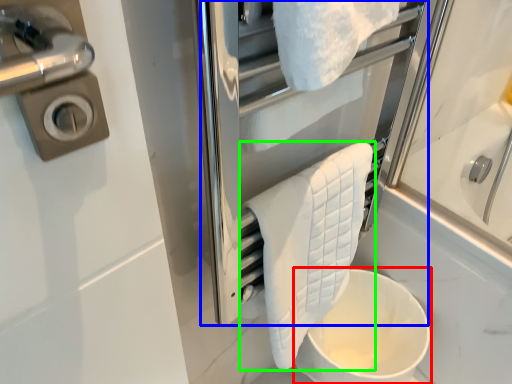
Question: Estimate the real-world distances between objects in this image. Which object is farther from toilet bowl (highlighted by a red box), screen door (highlighted by a blue box) or towel (highlighted by a green box)?

Choices:
 (A) screen door
 (B) towel

Answer: (A)